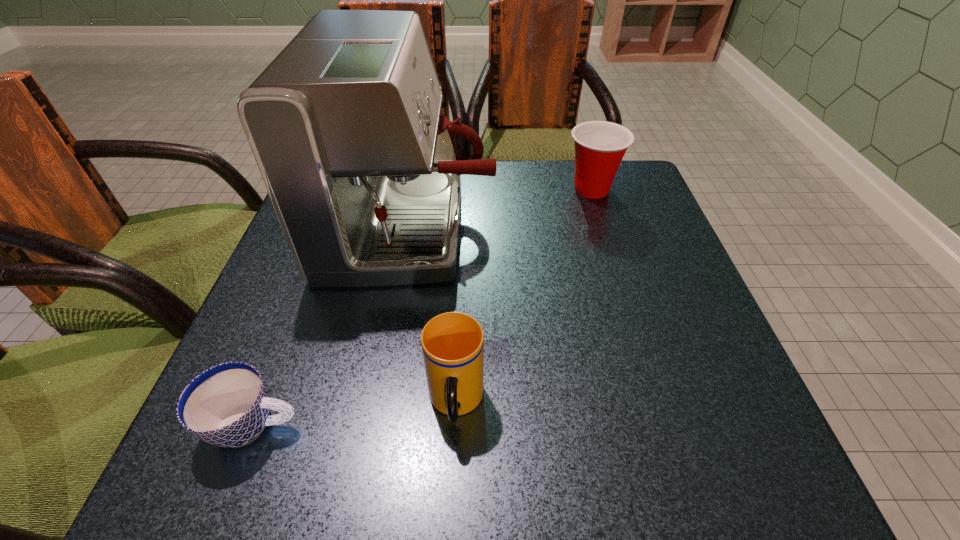
You are a GUI agent. You are given a task and a screenshot of the screen. Output one action in this format:
    pyautogui.click(x=<x>, y=<y>)
    Task: Click on the free space at the left edge of the desktop
    The width and height of the screenshot is (960, 540).
    Given the screenshot: What is the action you would take?
    pyautogui.click(x=276, y=268)

I want to click on free space at the right edge, so click(598, 234).

This screenshot has height=540, width=960. I want to click on vacant space at the far right corner, so click(x=617, y=186).

Where is `vacant space at the near right corner`? The image size is (960, 540). vacant space at the near right corner is located at coordinates (721, 434).

The image size is (960, 540). What are the coordinates of `vacant area between the second cup from right to left and the shortest cup` in the screenshot? It's located at (355, 414).

The width and height of the screenshot is (960, 540). I want to click on vacant area that lies between the shortest cup and the coffee maker, so click(x=332, y=327).

At what (x,y) coordinates should I click in order to perform the action: click on vacant area that lies between the tallest object and the rightmost cup. Please return your answer as a coordinate pair (x, y). The image size is (960, 540). Looking at the image, I should click on [x=501, y=208].

What are the coordinates of `free space between the rightmost cup and the shortest cup` in the screenshot? It's located at (423, 307).

Locate an element on the screen. This screenshot has height=540, width=960. vacant area that lies between the second cup from left to right and the rightmost cup is located at coordinates (524, 296).

Locate an element on the screen. This screenshot has height=540, width=960. free space between the second cup from left to right and the rightmost cup is located at coordinates (524, 296).